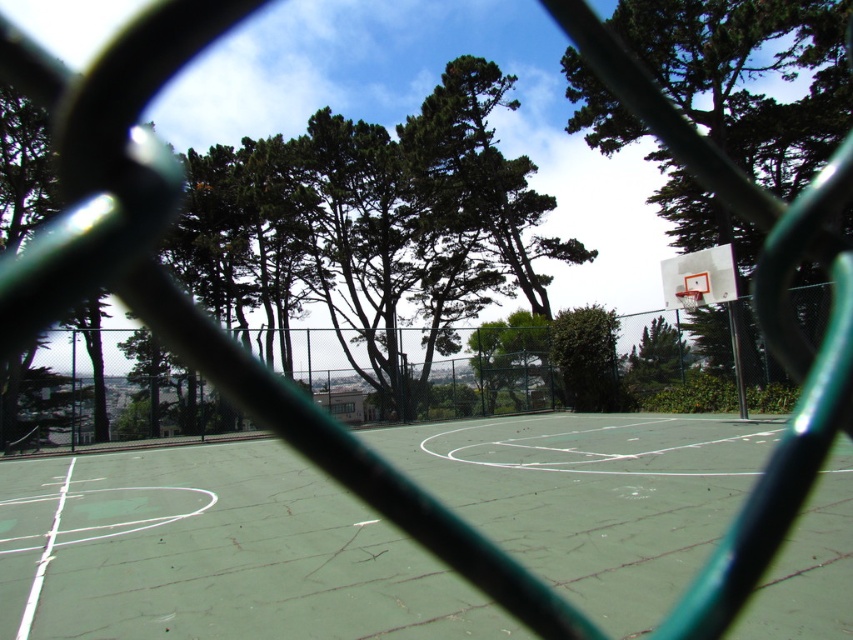
You are standing on the basketball court and looking towards the trees in the background. Which tree, the green leafy tree at upper center or the green leafy tree at upper right, appears to have a larger width from your perspective?

The green leafy tree at upper center might be wider than the green leafy tree at upper right according to the description.